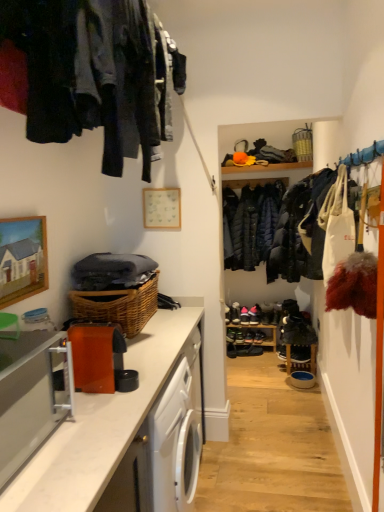
Find the location of a particular element. This screenshot has height=512, width=384. vacant area on top of black leather shoes at center (from a real-world perspective) is located at coordinates (256, 344).